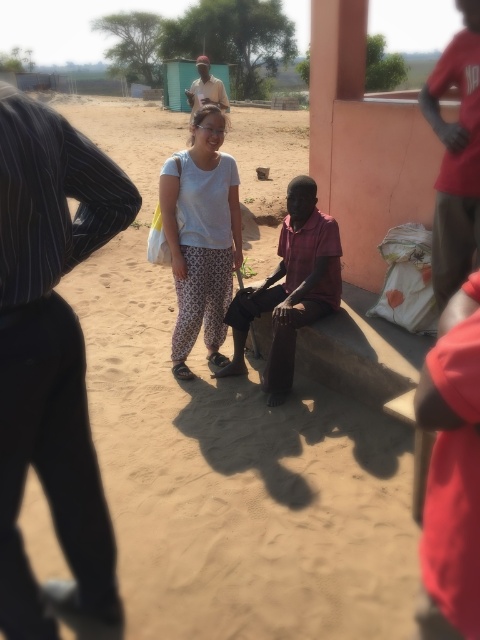
Question: Estimate the real-world distances between objects in this image. Which object is closer to the red cotton shirt at right?

Choices:
 (A) dark brown leather jacket at upper center
 (B) black striped shirt at left

Answer: (B)

Question: Is red cotton shirt at right positioned before dark brown leather jacket at upper center?

Choices:
 (A) no
 (B) yes

Answer: (B)

Question: Among these points, which one is nearest to the camera?

Choices:
 (A) (450, 60)
 (B) (336, 256)

Answer: (A)

Question: Estimate the real-world distances between objects in this image. Which object is farther from the white cotton shirt at center?

Choices:
 (A) black striped shirt at left
 (B) dark red fabric shirt at center
 (C) dark brown leather jacket at upper center

Answer: (A)

Question: Is dark red fabric shirt at center above red cotton shirt at right?

Choices:
 (A) no
 (B) yes

Answer: (A)

Question: Can you confirm if dark red fabric shirt at center is bigger than red cotton shirt at right?

Choices:
 (A) yes
 (B) no

Answer: (A)